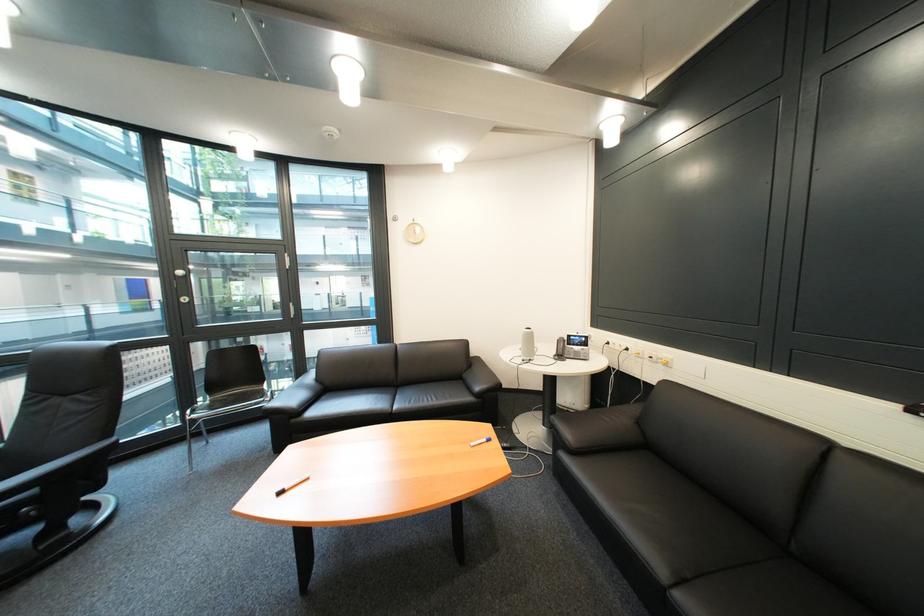
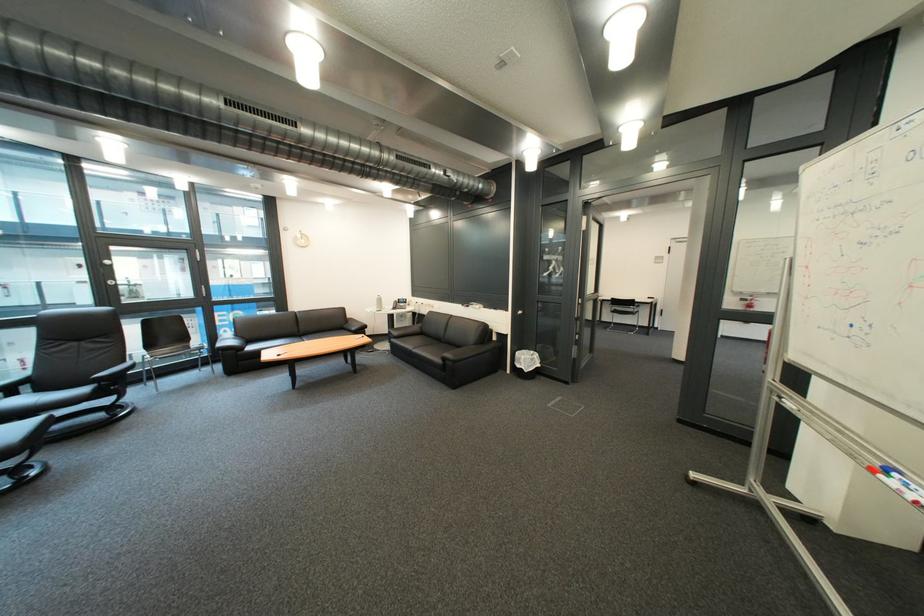
Locate, in the second image, the point that corresponds to point (410, 382) in the first image.

(312, 334)